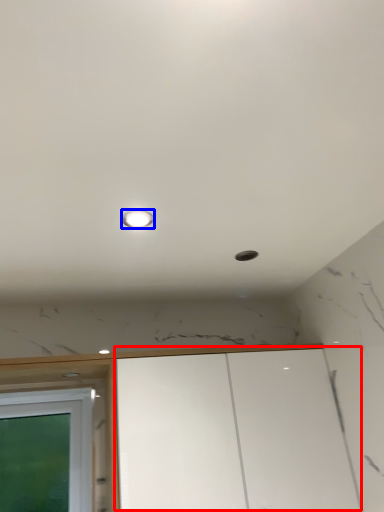
Question: Which point is closer to the camera, cabinetry (highlighted by a red box) or light (highlighted by a blue box)?

Choices:
 (A) cabinetry
 (B) light

Answer: (B)